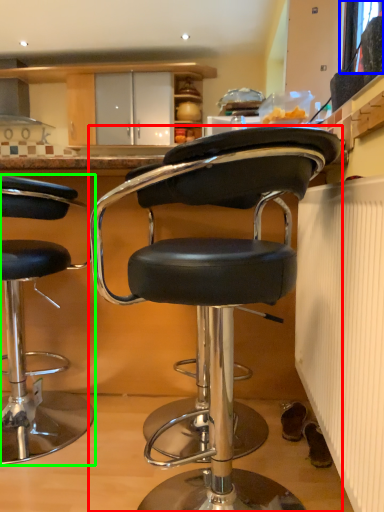
Question: Which object is positioned closest to chair (highlighted by a red box)? Select from window screen (highlighted by a blue box) and chair (highlighted by a green box).

Choices:
 (A) window screen
 (B) chair

Answer: (B)